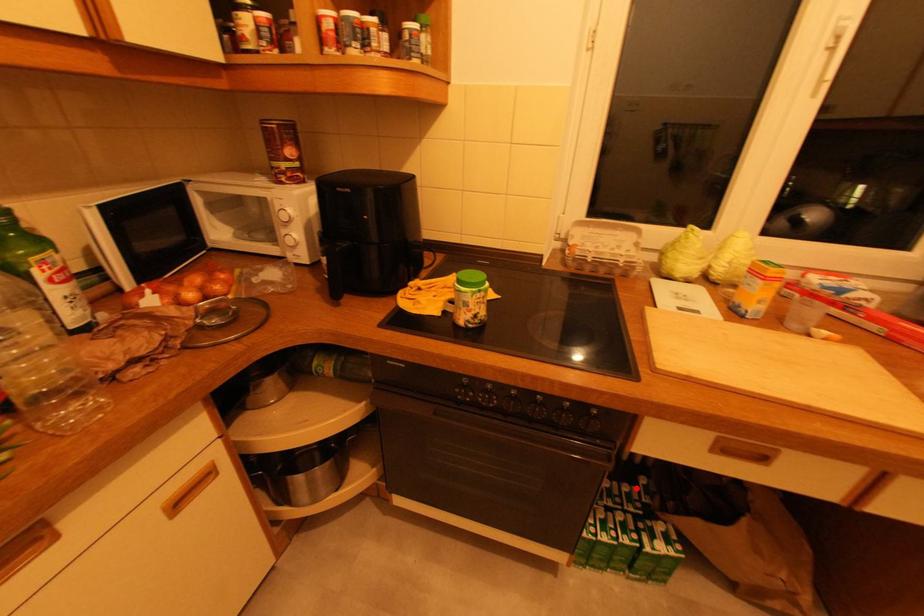
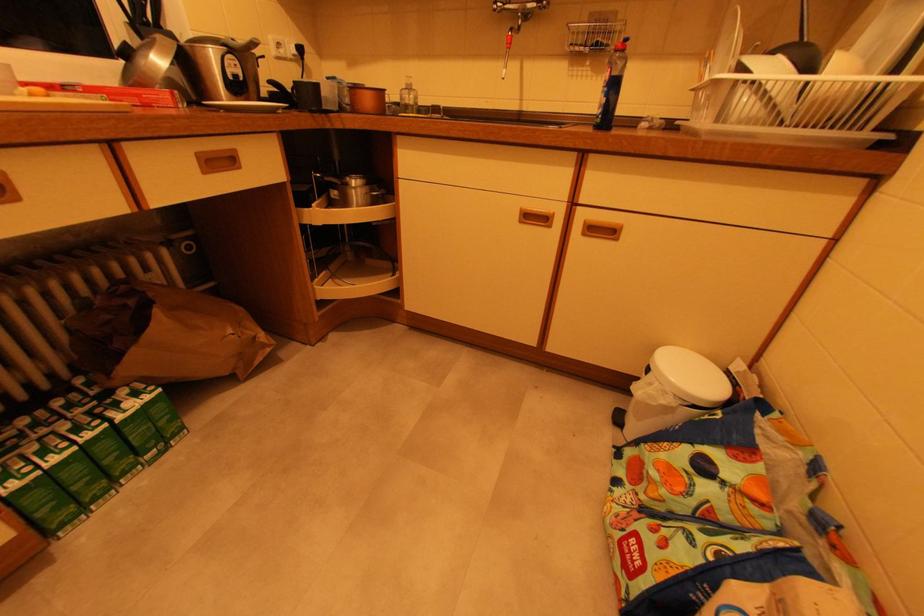
In the second image, find the point that corresponds to the highlighted location in the first image.

(78, 395)